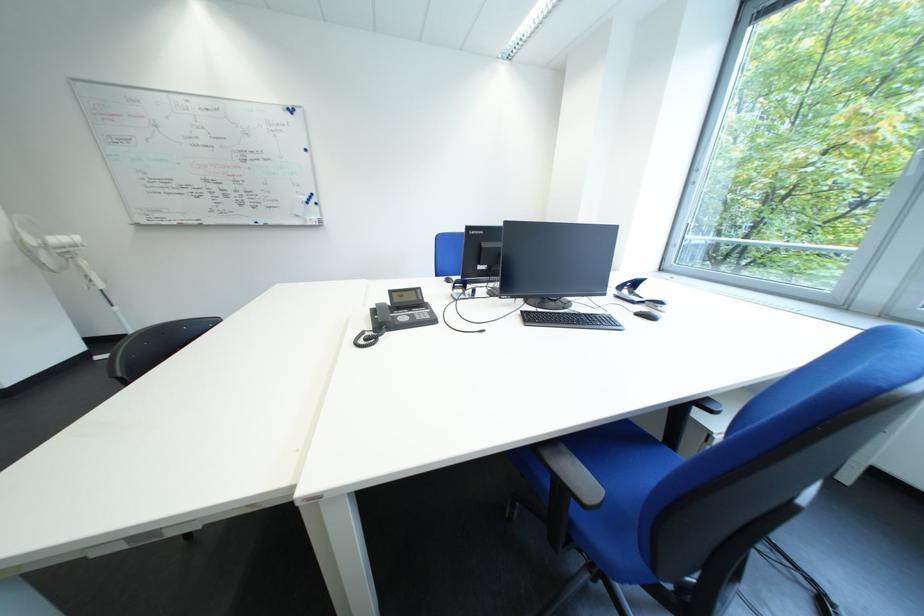
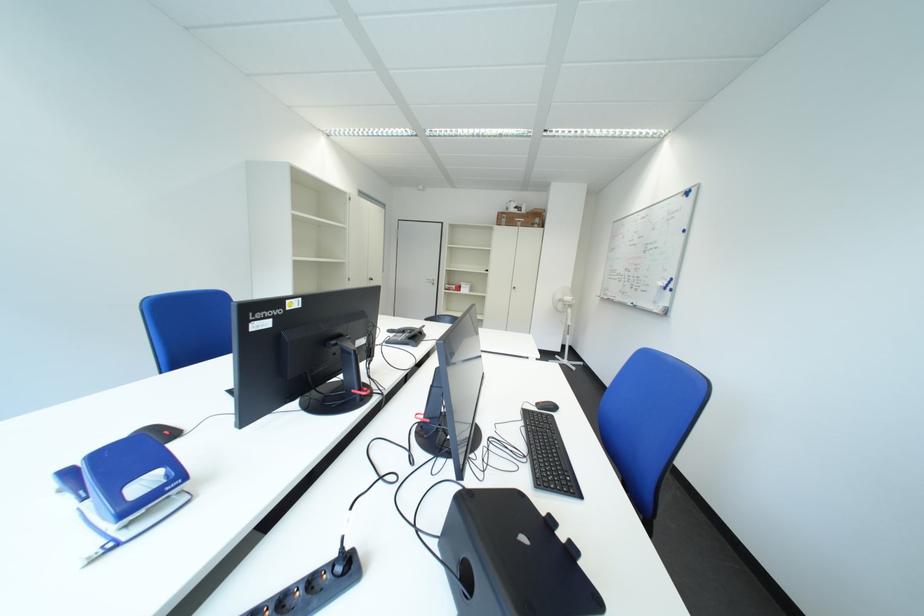
In the second image, find the point that corresponds to (x=416, y=320) in the first image.

(411, 336)